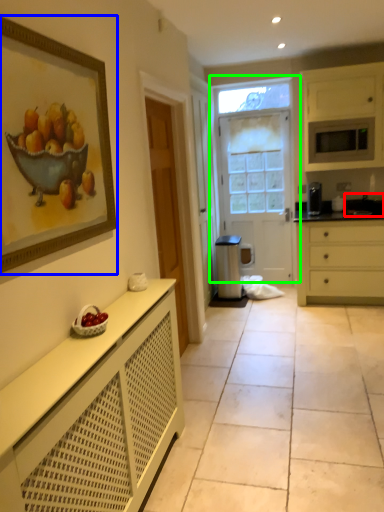
Question: Which object is the closest to the sink (highlighted by a red box)? Choose among these: picture frame (highlighted by a blue box) or door (highlighted by a green box).

Choices:
 (A) picture frame
 (B) door

Answer: (B)